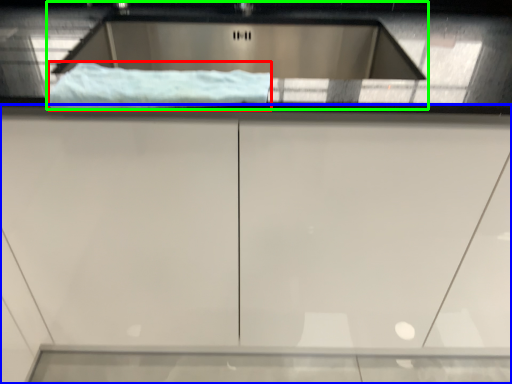
Question: Considering the real-world distances, which object is closest to material (highlighted by a red box)? cabinetry (highlighted by a blue box) or sink (highlighted by a green box).

Choices:
 (A) cabinetry
 (B) sink

Answer: (A)